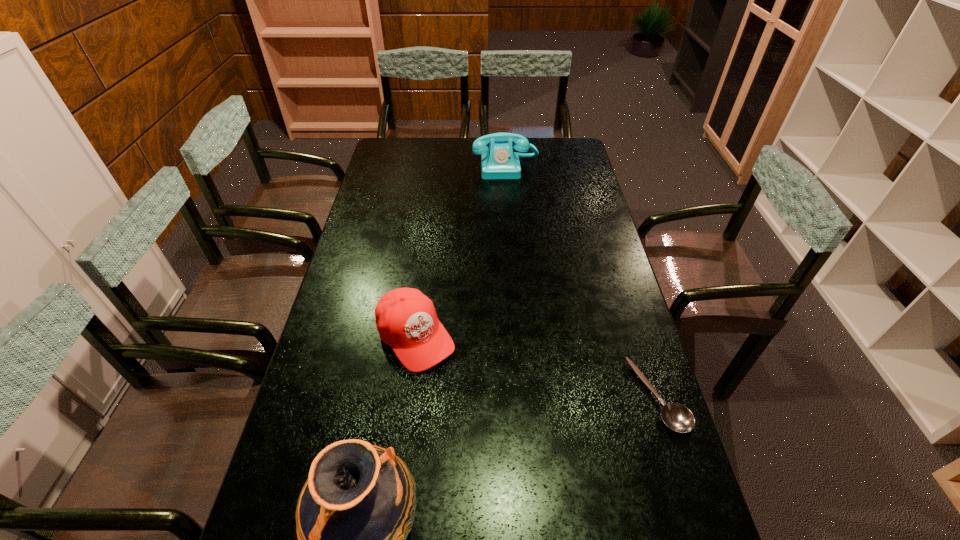
Locate an element on the screen. the rightmost object is located at coordinates (677, 417).

The height and width of the screenshot is (540, 960). I want to click on the shortest object, so click(x=677, y=417).

Where is `telephone`? telephone is located at coordinates (499, 161).

At what (x,y) coordinates should I click in order to perform the action: click on the second tallest object. Please return your answer as a coordinate pair (x, y). Looking at the image, I should click on (499, 161).

I want to click on baseball cap, so click(x=406, y=319).

Identify the location of vacant area located 0.140m on the front of the ladle. The width and height of the screenshot is (960, 540). (x=690, y=498).

Identify the location of vacant space located 0.120m on the dial of the third object from left to right. This screenshot has width=960, height=540. (510, 196).

This screenshot has height=540, width=960. I want to click on free space located 0.200m on the dial of the third object from left to right, so click(511, 208).

The image size is (960, 540). What are the coordinates of `vacant space located on the dial of the third object from left to right` in the screenshot? It's located at (511, 208).

This screenshot has width=960, height=540. Identify the location of vacant space located 0.100m on the front panel of the second shortest object. (459, 391).